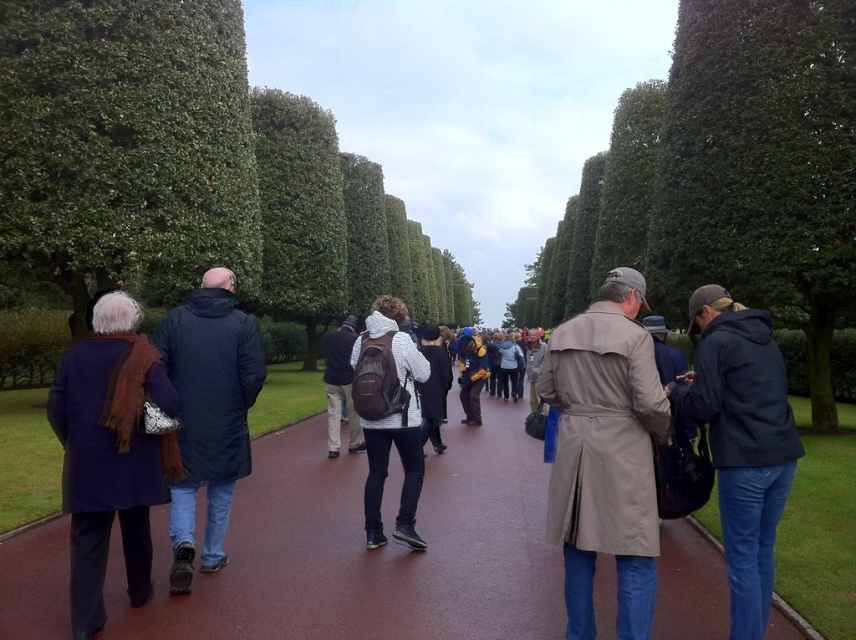
Describe the element at coordinates (727, 179) in the screenshot. The image size is (856, 640). I see `green leafy tree at center` at that location.

In the scene shown: Who is shorter, green leafy tree at center or dark blue coat at center?

With less height is dark blue coat at center.

At what (x,y) coordinates should I click in order to perform the action: click on green leafy tree at center. Please return your answer as a coordinate pair (x, y). Image resolution: width=856 pixels, height=640 pixels. Looking at the image, I should click on point(727,179).

This screenshot has height=640, width=856. Find the location of `brown asphalt at center`. brown asphalt at center is located at coordinates (369, 554).

Is the position of brown asphalt at center less distant than that of matte brown backpack at center?

Yes.

What do you see at coordinates (369, 554) in the screenshot? This screenshot has height=640, width=856. I see `brown asphalt at center` at bounding box center [369, 554].

Locate an element on the screen. This screenshot has width=856, height=640. brown asphalt at center is located at coordinates 369,554.

Between green leafy tree at center and matte blue coat at left, which one has less height?

With less height is matte blue coat at left.

Between green leafy tree at center and matte blue coat at left, which one has more height?

green leafy tree at center

You are a GUI agent. You are given a task and a screenshot of the screen. Output one action in this format:
    pyautogui.click(x=<x>, y=<y>)
    Task: Click on the green leafy tree at center
    The image size is (856, 640).
    Given the screenshot: What is the action you would take?
    pyautogui.click(x=727, y=179)